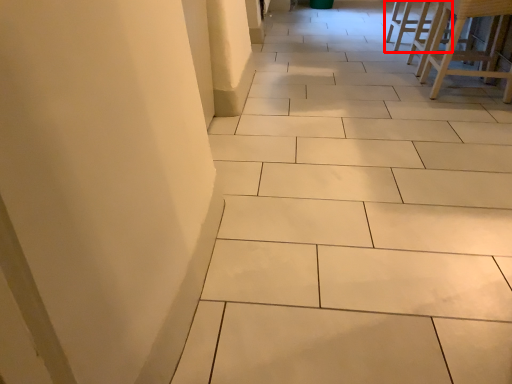
Question: Observing the image, what is the correct spatial positioning of furniture (annotated by the red box) in reference to furniture?

Choices:
 (A) right
 (B) left

Answer: (A)